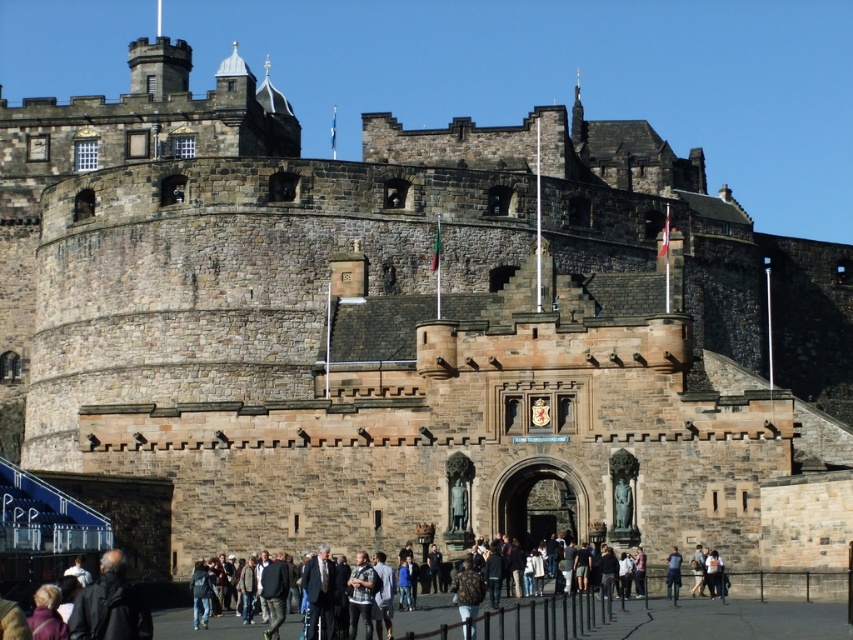
Question: Observing the image, what is the correct spatial positioning of dark brown leather jacket at lower left in reference to dark blue jeans at lower center?

Choices:
 (A) right
 (B) left

Answer: (B)

Question: Which point appears closest to the camera in this image?

Choices:
 (A) (671, 577)
 (B) (123, 593)

Answer: (B)

Question: Which point is farther to the camera?

Choices:
 (A) (x=108, y=609)
 (B) (x=677, y=579)

Answer: (B)

Question: Where is dark brown leather jacket at lower left located in relation to dark blue jeans at lower center in the image?

Choices:
 (A) right
 (B) left

Answer: (B)

Question: Is dark brown leather jacket at lower left above dark blue jeans at lower center?

Choices:
 (A) no
 (B) yes

Answer: (B)